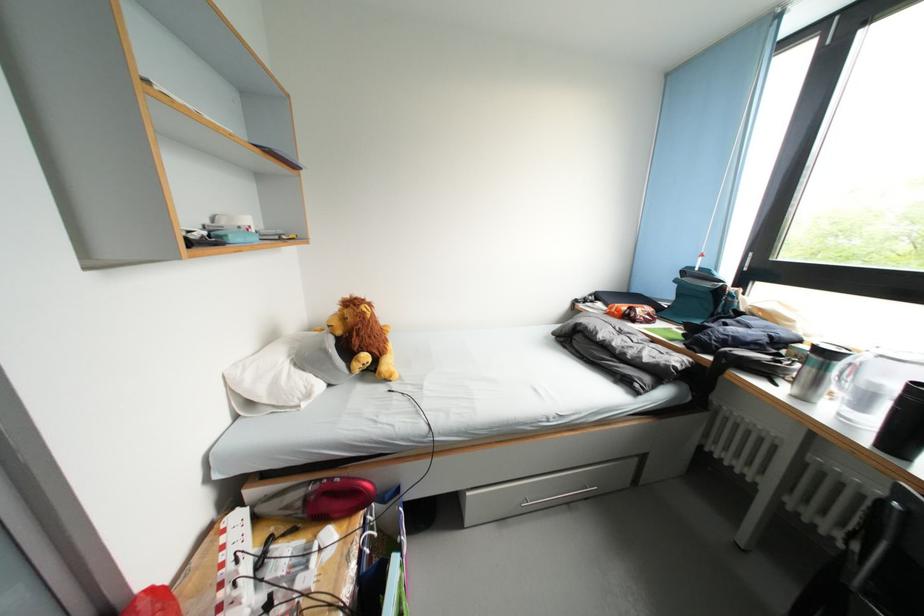
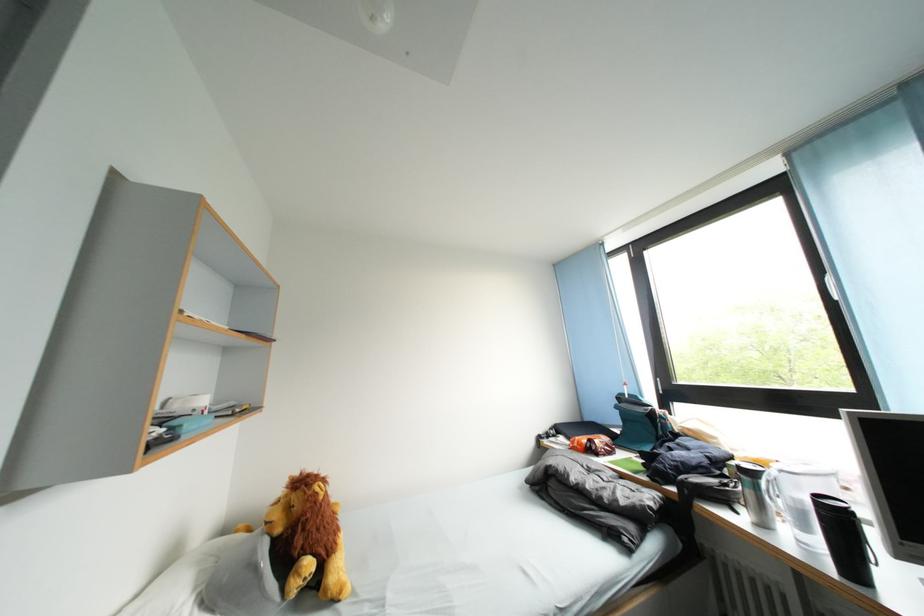
The point at (638,358) is marked in the first image. Where is the corresponding point in the second image?

(614, 501)